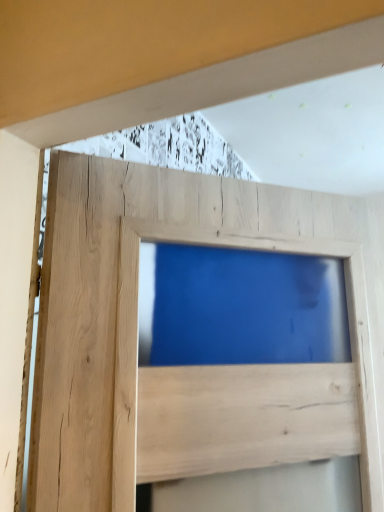
Locate an element on the screen. natural wood door at center is located at coordinates (176, 368).

What do you see at coordinates (176, 368) in the screenshot? This screenshot has height=512, width=384. I see `natural wood door at center` at bounding box center [176, 368].

The height and width of the screenshot is (512, 384). In order to click on natural wood door at center in this screenshot , I will do `click(176, 368)`.